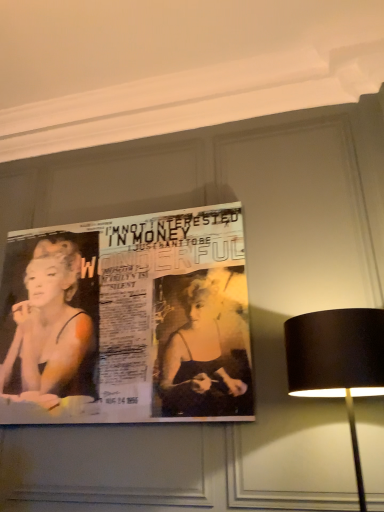
Question: Is black fabric lampshade at right to the left or to the right of matte paper poster at upper center in the image?

Choices:
 (A) right
 (B) left

Answer: (A)

Question: In the image, is black fabric lampshade at right positioned in front of or behind matte paper poster at upper center?

Choices:
 (A) behind
 (B) front

Answer: (B)

Question: In terms of height, does black fabric lampshade at right look taller or shorter compared to matte paper poster at upper center?

Choices:
 (A) short
 (B) tall

Answer: (A)

Question: From a real-world perspective, relative to black fabric lampshade at right, is matte paper poster at upper center vertically above or below?

Choices:
 (A) above
 (B) below

Answer: (A)

Question: Considering the positions of point (220, 355) and point (349, 373), is point (220, 355) closer or farther from the camera than point (349, 373)?

Choices:
 (A) farther
 (B) closer

Answer: (A)

Question: In terms of width, does matte paper poster at upper center look wider or thinner when compared to black fabric lampshade at right?

Choices:
 (A) thin
 (B) wide

Answer: (A)

Question: Based on their sizes in the image, would you say matte paper poster at upper center is bigger or smaller than black fabric lampshade at right?

Choices:
 (A) small
 (B) big

Answer: (A)